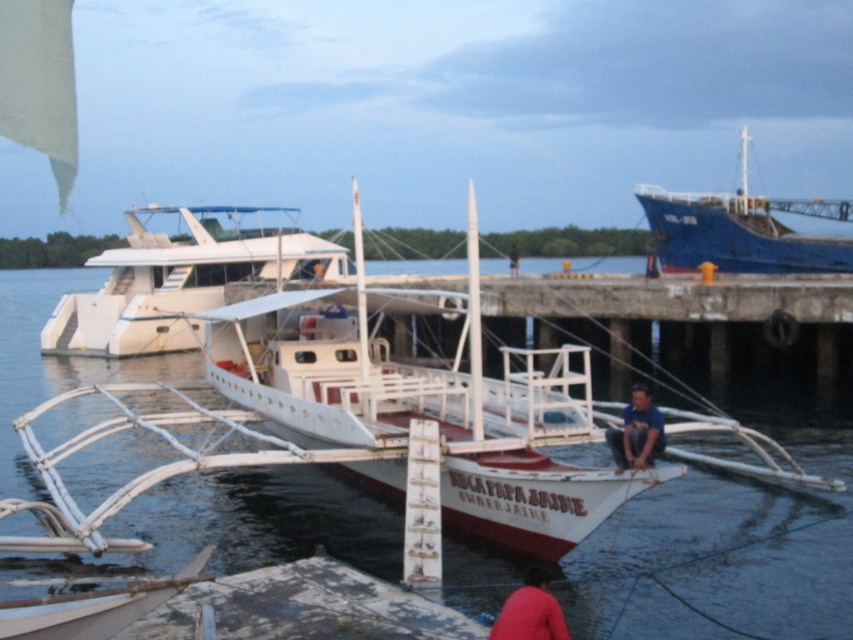
What is the position of the blue matte ship at upper right relative to the red fabric shirt at lower center in the waterfront scene?

The blue matte ship at upper right is located above the red fabric shirt at lower center.

From the picture: You are a photographer standing on the dock and want to take a photo of both the blue fabric shirt at center and the dark blue shirt at center. Which shirt will appear closer to the camera in the photo?

The blue fabric shirt at center will appear closer to the camera because it is positioned in front of the dark blue shirt at center.

You are a photographer planning to take a photo of the transparent water at boat center and the white matte yacht at center from the shore. Based on their positions, which object should you place on the left side of your photo?

The transparent water at boat center should be placed on the left side of the photo since it is located to the left of the white matte yacht at center according to the description.